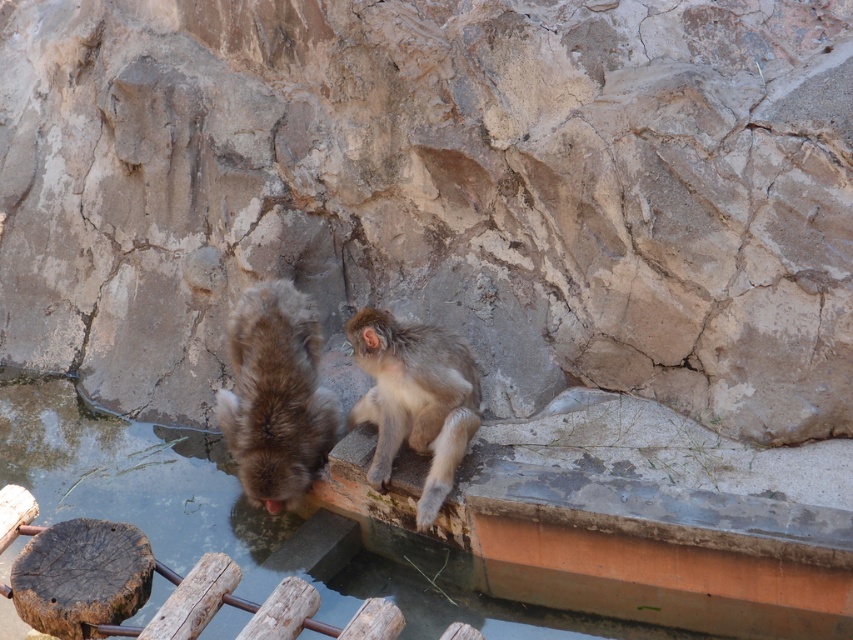
Does clear water at monkey right appear on the right side of fuzzy gray monkey at center?

Incorrect, clear water at monkey right is not on the right side of fuzzy gray monkey at center.

Who is more forward, (454, 579) or (442, 444)?

Point (442, 444) is more forward.

What do you see at coordinates (265, 522) in the screenshot? The width and height of the screenshot is (853, 640). I see `clear water at monkey right` at bounding box center [265, 522].

You are a GUI agent. You are given a task and a screenshot of the screen. Output one action in this format:
    pyautogui.click(x=<x>, y=<y>)
    Task: Click on the clear water at monkey right
    This screenshot has width=853, height=640.
    Given the screenshot: What is the action you would take?
    pyautogui.click(x=265, y=522)

Which is more to the left, fuzzy brown monkey at center or fuzzy gray monkey at center?

From the viewer's perspective, fuzzy brown monkey at center appears more on the left side.

Is point (316, 342) positioned in front of point (399, 344)?

No.

Who is more forward, (254, 460) or (428, 353)?

Positioned in front is point (428, 353).

I want to click on fuzzy brown monkey at center, so click(276, 394).

Is clear water at monkey right in front of fuzzy brown monkey at center?

Yes.

Does clear water at monkey right have a smaller size compared to fuzzy brown monkey at center?

No, clear water at monkey right is not smaller than fuzzy brown monkey at center.

Locate an element on the screen. The image size is (853, 640). clear water at monkey right is located at coordinates (265, 522).